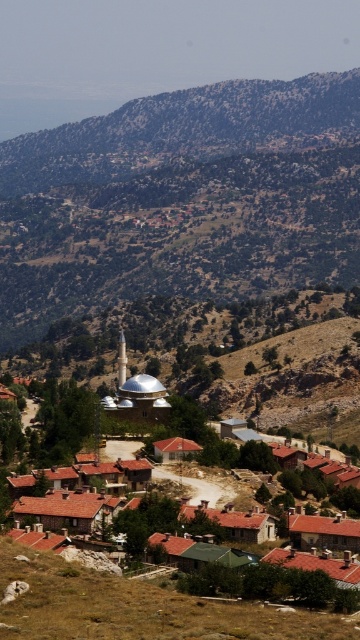
Between brown rocky mountain at upper center and brown tiled roofs at center, which one has less height?

brown tiled roofs at center is shorter.

Can you confirm if brown rocky mountain at upper center is bigger than brown tiled roofs at center?

Yes, brown rocky mountain at upper center is bigger than brown tiled roofs at center.

Which is in front, point (352, 132) or point (36, 499)?

Point (36, 499) is more forward.

Locate an element on the screen. The image size is (360, 640). brown rocky mountain at upper center is located at coordinates (186, 131).